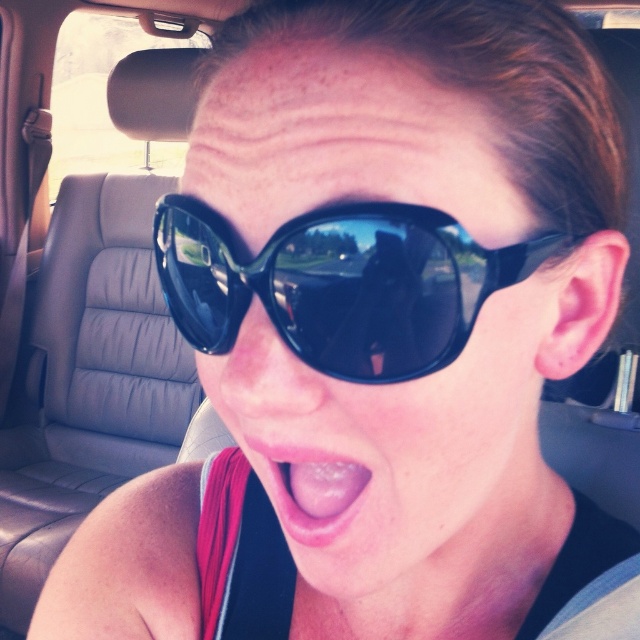
Is black plastic sunglasses at center smaller than black glossy sunglasses at center?

No.

Who is shorter, black plastic sunglasses at center or black glossy sunglasses at center?

With less height is black glossy sunglasses at center.

Between point (372, 157) and point (346, 273), which one is positioned behind?

Positioned behind is point (346, 273).

The height and width of the screenshot is (640, 640). In order to click on black plastic sunglasses at center in this screenshot , I will do `click(401, 458)`.

Is black plastic sunglasses at center in front of pink flesh at center?

That is True.

Is black plastic sunglasses at center bigger than pink flesh at center?

Correct, black plastic sunglasses at center is larger in size than pink flesh at center.

This screenshot has width=640, height=640. In order to click on black plastic sunglasses at center in this screenshot , I will do `click(401, 458)`.

Is black glossy sunglasses at center below pink flesh at center?

Incorrect, black glossy sunglasses at center is not positioned below pink flesh at center.

Does black glossy sunglasses at center have a greater width compared to pink flesh at center?

Yes.

This screenshot has height=640, width=640. What do you see at coordinates (339, 284) in the screenshot? I see `black glossy sunglasses at center` at bounding box center [339, 284].

You are a GUI agent. You are given a task and a screenshot of the screen. Output one action in this format:
    pyautogui.click(x=<x>, y=<y>)
    Task: Click on the black glossy sunglasses at center
    The height and width of the screenshot is (640, 640).
    Given the screenshot: What is the action you would take?
    coord(339,284)